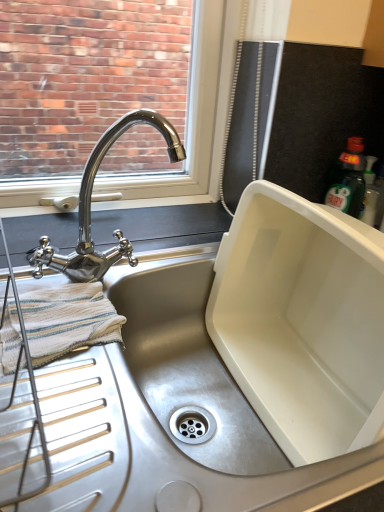
Question: Is white striped cloth at left in front of or behind polished chrome tap at upper left in the image?

Choices:
 (A) front
 (B) behind

Answer: (B)

Question: In the image, is white striped cloth at left on the left side or the right side of polished chrome tap at upper left?

Choices:
 (A) left
 (B) right

Answer: (A)

Question: Looking at the image, does white striped cloth at left seem bigger or smaller compared to polished chrome tap at upper left?

Choices:
 (A) big
 (B) small

Answer: (B)

Question: Considering the positions of polished chrome tap at upper left and white striped cloth at left in the image, is polished chrome tap at upper left taller or shorter than white striped cloth at left?

Choices:
 (A) short
 (B) tall

Answer: (B)

Question: Considering the relative positions of polished chrome tap at upper left and white striped cloth at left in the image provided, is polished chrome tap at upper left to the left or to the right of white striped cloth at left?

Choices:
 (A) left
 (B) right

Answer: (B)

Question: Is polished chrome tap at upper left situated inside white striped cloth at left or outside?

Choices:
 (A) outside
 (B) inside

Answer: (A)

Question: Is point (163, 132) closer or farther from the camera than point (11, 312)?

Choices:
 (A) closer
 (B) farther

Answer: (B)